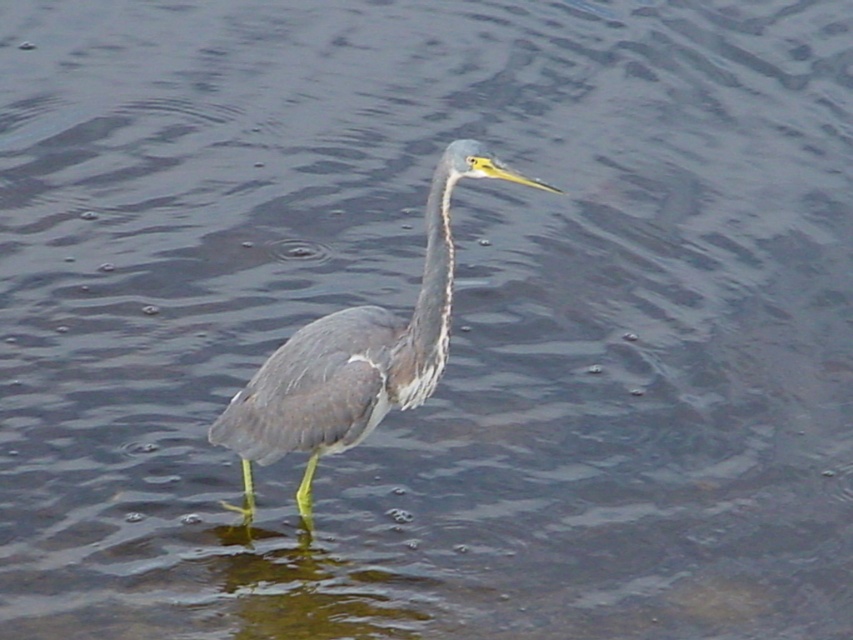
Question: Does gray matte heron at center have a lesser width compared to gray matte neck at center?

Choices:
 (A) yes
 (B) no

Answer: (B)

Question: Can you confirm if gray matte heron at center is positioned to the right of gray matte neck at center?

Choices:
 (A) yes
 (B) no

Answer: (B)

Question: Does gray matte heron at center have a larger size compared to gray matte neck at center?

Choices:
 (A) no
 (B) yes

Answer: (B)